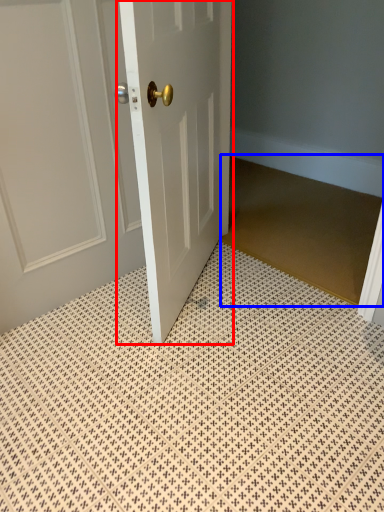
Question: Which object is closer to the camera taking this photo, door (highlighted by a red box) or doormat (highlighted by a blue box)?

Choices:
 (A) door
 (B) doormat

Answer: (A)